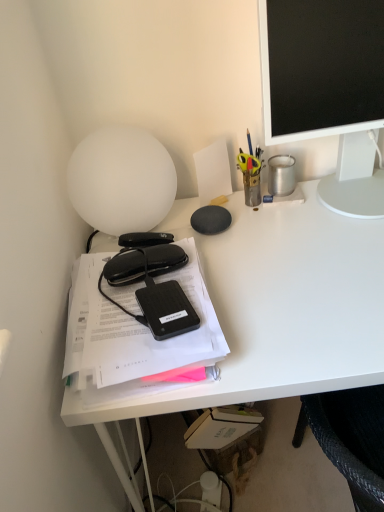
In order to click on vacant area in front of matte black monitor at upper right in this screenshot , I will do `click(334, 242)`.